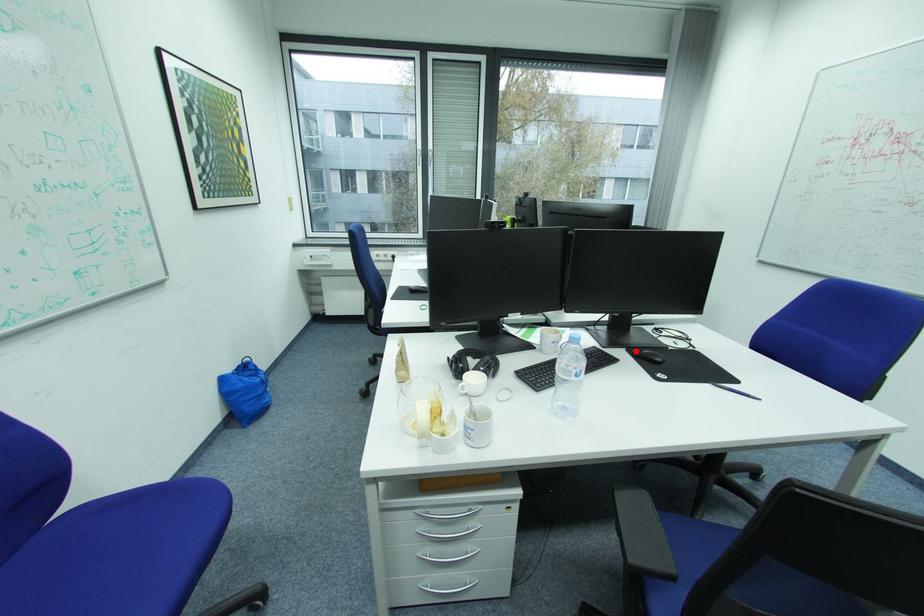
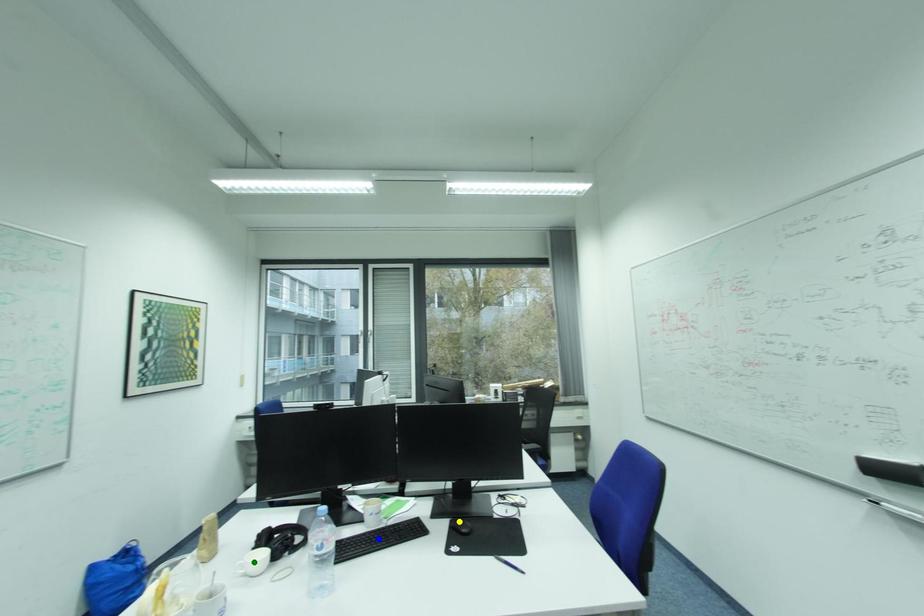
Question: I am providing you with two images of the same scene from different viewpoints. A red point is marked on the first image. You are given multiple points on the second image. Which mark in image 2 goes with the point in image 1?

Choices:
 (A) yellow point
 (B) green point
 (C) blue point

Answer: (A)